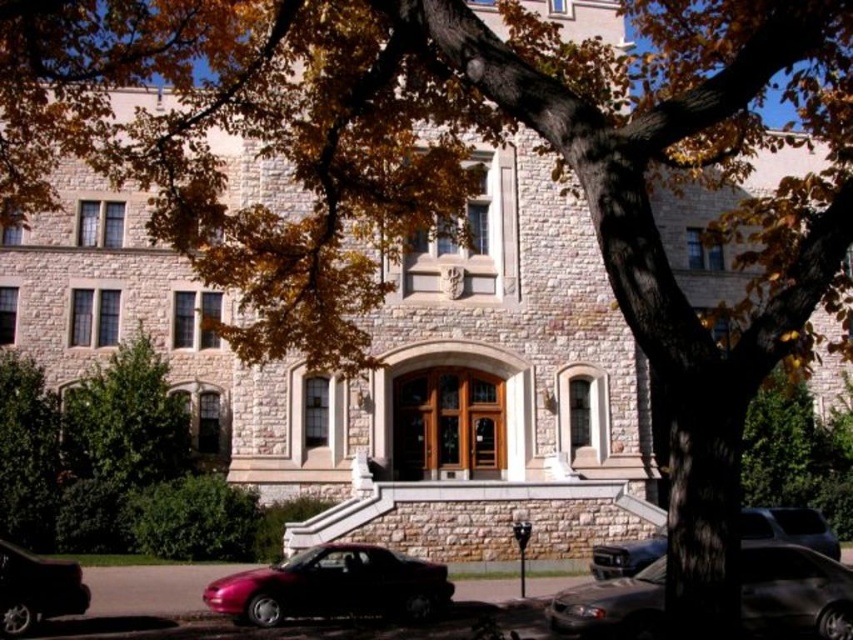
Question: Does shiny black sedan at lower right appear on the right side of shiny red car at lower left?

Choices:
 (A) no
 (B) yes

Answer: (B)

Question: Based on their relative distances, which object is farther from the shiny red car at lower left?

Choices:
 (A) shiny black sedan at lower right
 (B) shiny black car at lower left

Answer: (B)

Question: Is shiny red car at lower left in front of shiny black car at lower left?

Choices:
 (A) yes
 (B) no

Answer: (B)

Question: Based on their relative distances, which object is nearer to the shiny black car at lower left?

Choices:
 (A) metallic silver sedan at lower right
 (B) shiny black sedan at lower right
 (C) shiny red car at lower left

Answer: (C)

Question: Which point is closer to the camera?

Choices:
 (A) metallic silver sedan at lower right
 (B) shiny black car at lower left
 (C) shiny red car at lower left
 (D) shiny black sedan at lower right

Answer: (D)

Question: Is shiny red car at lower left to the left of metallic silver sedan at lower right from the viewer's perspective?

Choices:
 (A) yes
 (B) no

Answer: (A)